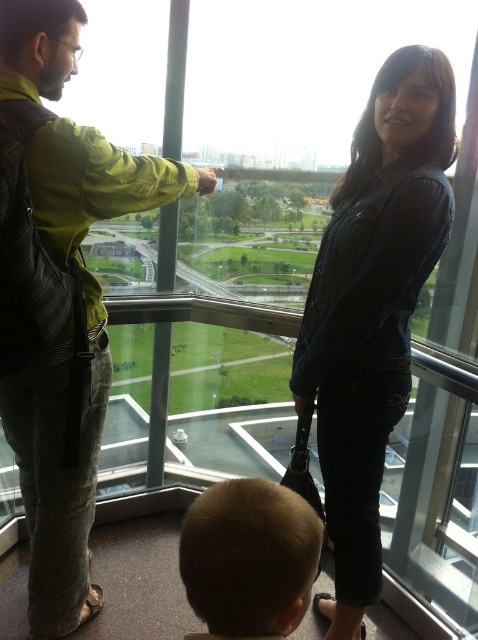
Question: Based on their relative distances, which object is nearer to the denim jacket at center?

Choices:
 (A) green fabric jacket at upper left
 (B) blonde hair at lower center

Answer: (A)

Question: Which object is the farthest from the blonde hair at lower center?

Choices:
 (A) denim jacket at center
 (B) green fabric jacket at upper left

Answer: (B)

Question: Does denim jacket at center have a larger size compared to blonde hair at lower center?

Choices:
 (A) yes
 (B) no

Answer: (A)

Question: Which object appears closest to the camera in this image?

Choices:
 (A) blonde hair at lower center
 (B) denim jacket at center
 (C) green fabric jacket at upper left

Answer: (A)

Question: Can you confirm if green fabric jacket at upper left is smaller than denim jacket at center?

Choices:
 (A) no
 (B) yes

Answer: (A)

Question: Observing the image, what is the correct spatial positioning of green fabric jacket at upper left in reference to blonde hair at lower center?

Choices:
 (A) below
 (B) above

Answer: (B)